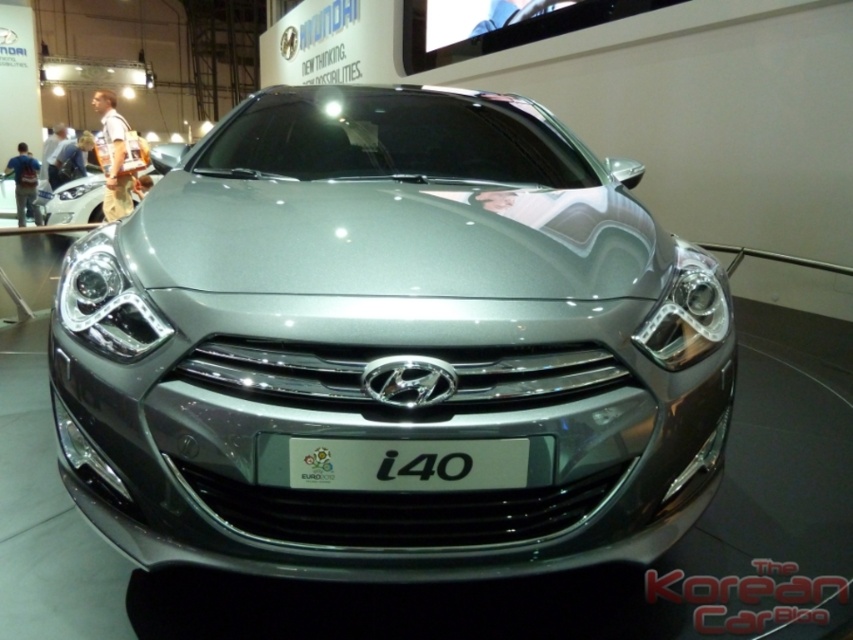
Who is positioned more to the right, chrome metallic headlight at left or satin silver car at left?

chrome metallic headlight at left is more to the right.

Between point (91, 324) and point (68, 198), which one is positioned in front?

Point (91, 324) is in front.

The width and height of the screenshot is (853, 640). In order to click on chrome metallic headlight at left in this screenshot , I will do `click(106, 301)`.

You are a GUI agent. You are given a task and a screenshot of the screen. Output one action in this format:
    pyautogui.click(x=<x>, y=<y>)
    Task: Click on the chrome metallic headlight at left
    The width and height of the screenshot is (853, 640).
    Given the screenshot: What is the action you would take?
    pyautogui.click(x=106, y=301)

Can you confirm if sleek chrome headlight at center is bigger than satin silver car at left?

Actually, sleek chrome headlight at center might be smaller than satin silver car at left.

Who is more distant from viewer, (637, 332) or (102, 184)?

The point (102, 184) is more distant.

Describe the element at coordinates (688, 312) in the screenshot. I see `sleek chrome headlight at center` at that location.

You are a GUI agent. You are given a task and a screenshot of the screen. Output one action in this format:
    pyautogui.click(x=<x>, y=<y>)
    Task: Click on the sleek chrome headlight at center
    The image size is (853, 640).
    Given the screenshot: What is the action you would take?
    pyautogui.click(x=688, y=312)

Between white metallic license plate at center and sleek chrome headlight at center, which one has more height?

sleek chrome headlight at center is taller.

Does white metallic license plate at center appear on the left side of sleek chrome headlight at center?

Yes, white metallic license plate at center is to the left of sleek chrome headlight at center.

Is point (432, 440) farther from viewer compared to point (692, 323)?

No, (432, 440) is in front of (692, 323).

At what (x,y) coordinates should I click in order to perform the action: click on white metallic license plate at center. Please return your answer as a coordinate pair (x, y). The height and width of the screenshot is (640, 853). Looking at the image, I should click on (407, 464).